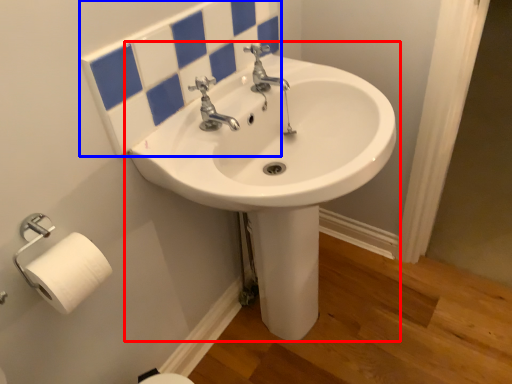
Question: Which object is closer to the camera taking this photo, sink (highlighted by a red box) or mirror (highlighted by a blue box)?

Choices:
 (A) sink
 (B) mirror

Answer: (A)